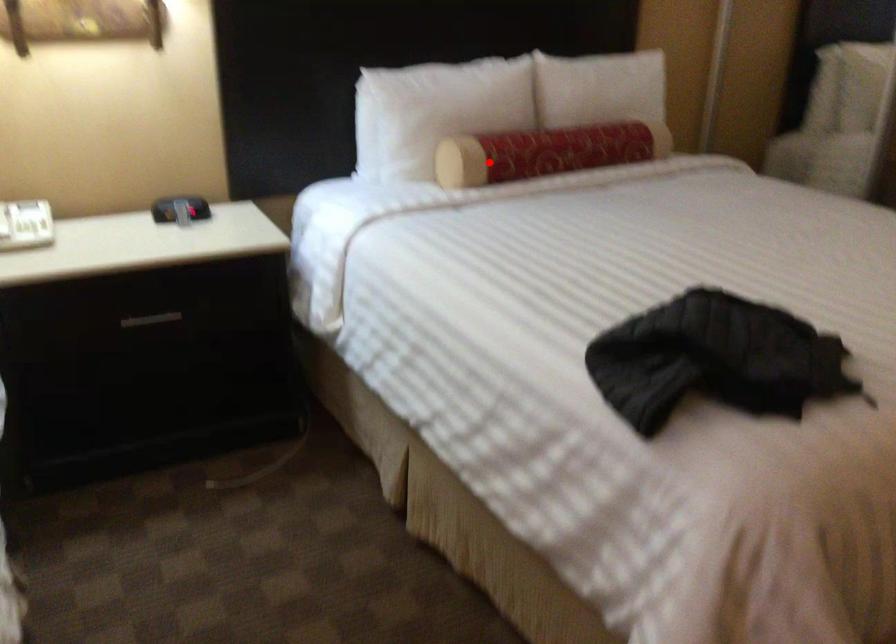
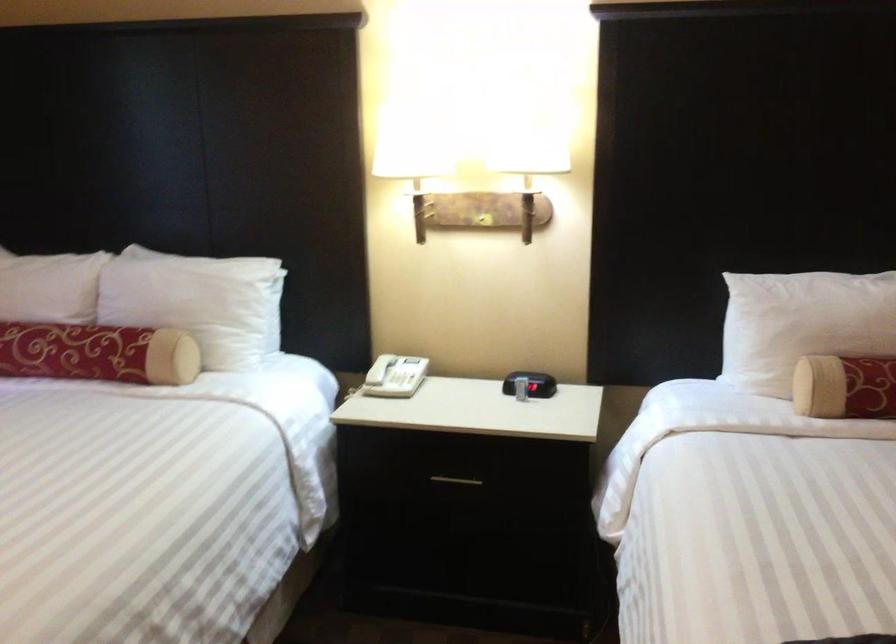
The point at the highlighted location is marked in the first image. Where is the corresponding point in the second image?

(845, 386)